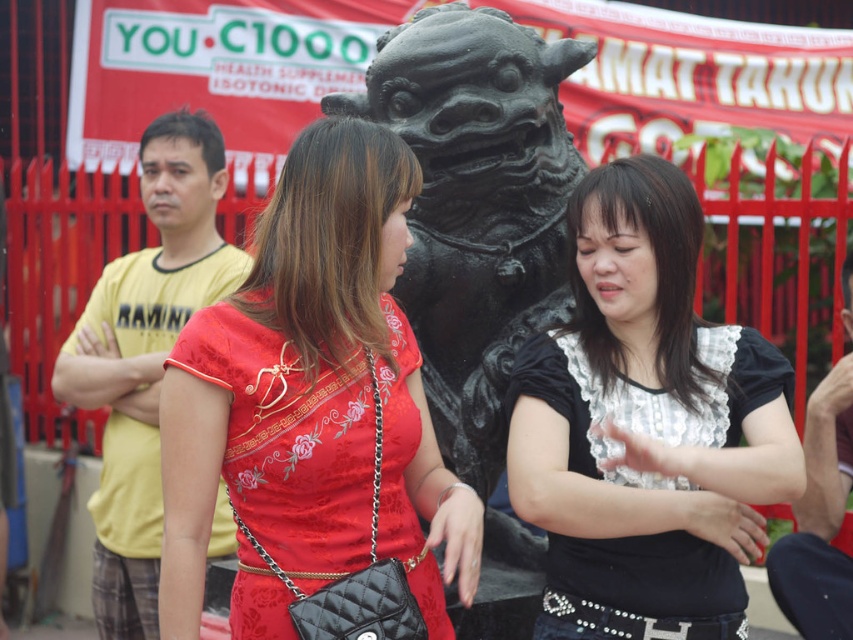
Locate an element on the screen. The image size is (853, 640). black lace blouse at center is located at coordinates (646, 426).

Does point (525, 493) come farther from viewer compared to point (500, 35)?

No.

Locate an element on the screen. The image size is (853, 640). black lace blouse at center is located at coordinates (646, 426).

Consider the image. Between matte red dress at center and black stone statue at center, which one has less height?

With less height is black stone statue at center.

Does point (286, 288) come in front of point (454, 100)?

No, it is not.

Does point (463, 536) lie in front of point (439, 202)?

Yes, it is in front of point (439, 202).

You are a GUI agent. You are given a task and a screenshot of the screen. Output one action in this format:
    pyautogui.click(x=<x>, y=<y>)
    Task: Click on the matte red dress at center
    
    Given the screenshot: What is the action you would take?
    click(x=312, y=404)

Does matte red dress at center come in front of black lace blouse at center?

Yes, it is.

Locate an element on the screen. matte red dress at center is located at coordinates (312, 404).

Between point (184, 416) and point (618, 330), which one is positioned behind?

Positioned behind is point (618, 330).

Where is `matte red dress at center`? Image resolution: width=853 pixels, height=640 pixels. matte red dress at center is located at coordinates (312, 404).